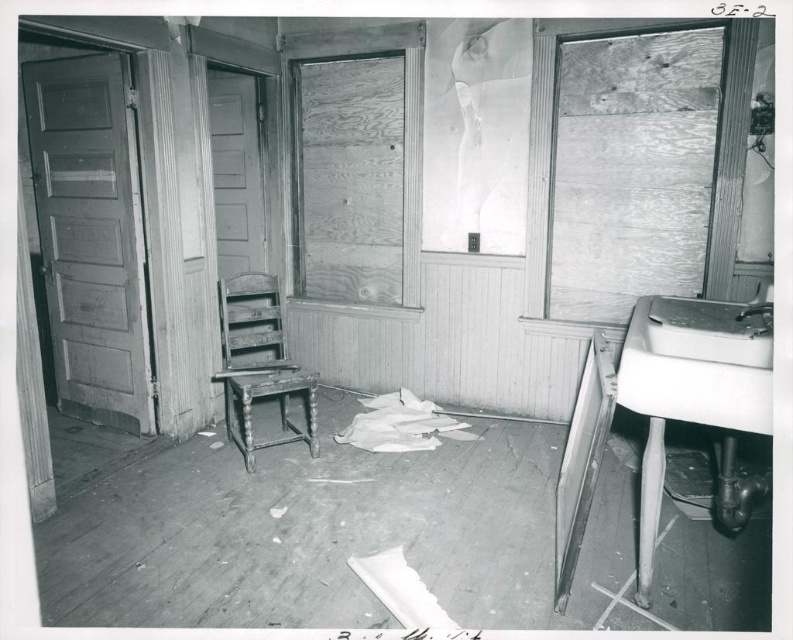
Question: Can you confirm if wooden chair at center is wider than white porcelain sink at right?

Choices:
 (A) no
 (B) yes

Answer: (B)

Question: Which is nearer to the wooden paneling at right?

Choices:
 (A) wooden chair at center
 (B) white porcelain sink at right

Answer: (B)

Question: Which is nearer to the wooden chair at center?

Choices:
 (A) wooden paneling at right
 (B) white porcelain sink at right

Answer: (A)

Question: Which of the following is the farthest from the observer?

Choices:
 (A) (621, 392)
 (B) (282, 355)

Answer: (B)

Question: Can you confirm if wooden paneling at right is smaller than white porcelain sink at right?

Choices:
 (A) yes
 (B) no

Answer: (B)

Question: Is wooden chair at center below white porcelain sink at right?

Choices:
 (A) yes
 (B) no

Answer: (A)